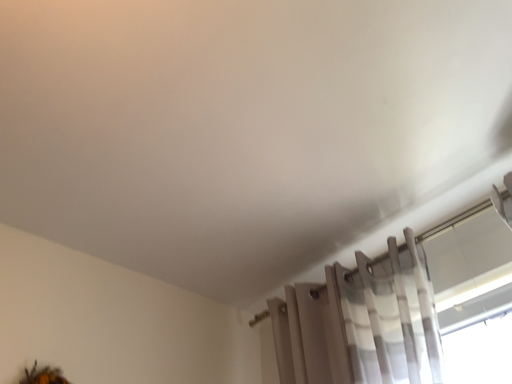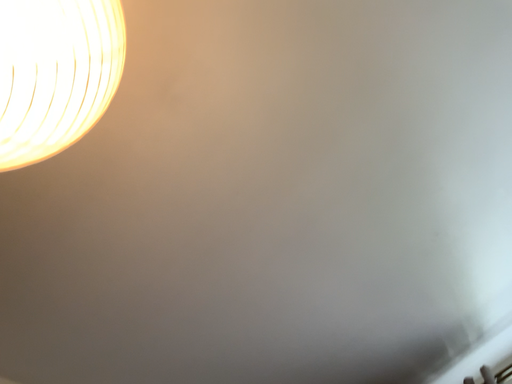
Question: Which way did the camera rotate in the video?

Choices:
 (A) rotated downward
 (B) rotated upward

Answer: (B)